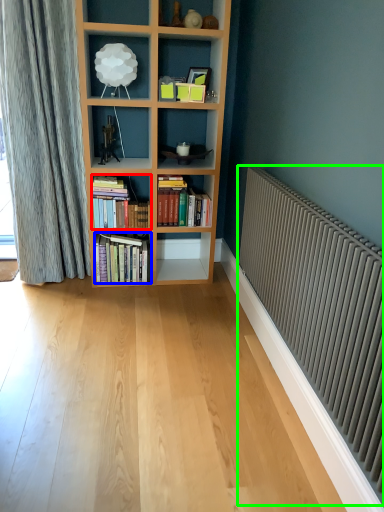
Question: Estimate the real-world distances between objects in this image. Which object is closer to book (highlighted by a red box), book (highlighted by a blue box) or radiator (highlighted by a green box)?

Choices:
 (A) book
 (B) radiator

Answer: (A)